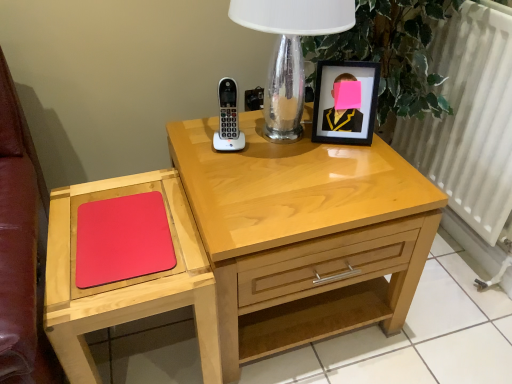
At what (x,y) coordinates should I click in order to perform the action: click on free location above rubberized matte red mousepad at left (from a real-world perspective). Please return your answer as a coordinate pair (x, y). This screenshot has width=512, height=384. Looking at the image, I should click on (124, 226).